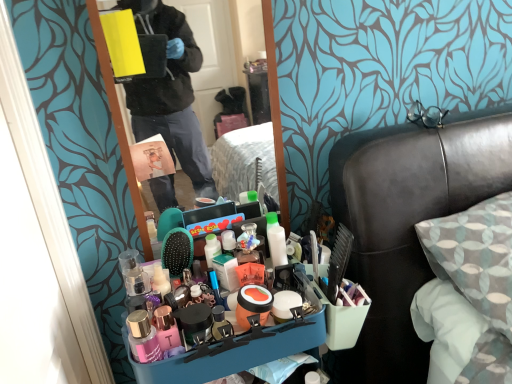
Question: Based on their positions, is clear plastic mirror at center located to the left or right of matte pink book at center?

Choices:
 (A) right
 (B) left

Answer: (A)

Question: From a real-world perspective, is clear plastic mirror at center positioned above or below matte pink book at center?

Choices:
 (A) below
 (B) above

Answer: (B)

Question: Estimate the real-world distances between objects in this image. Which object is closer to the clear plastic mirror at center?

Choices:
 (A) yellow matte box at upper left
 (B) black leather headboard at upper right
 (C) matte pink book at center
 (D) blue plastic tray at center

Answer: (C)

Question: Which is farther from the clear plastic mirror at center?

Choices:
 (A) matte pink book at center
 (B) yellow matte box at upper left
 (C) black leather headboard at upper right
 (D) blue plastic tray at center

Answer: (D)